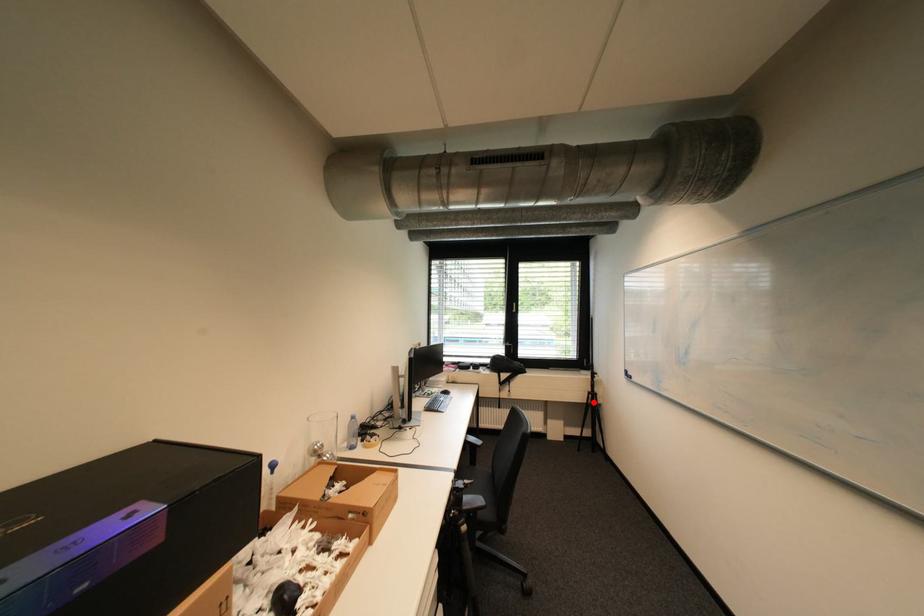
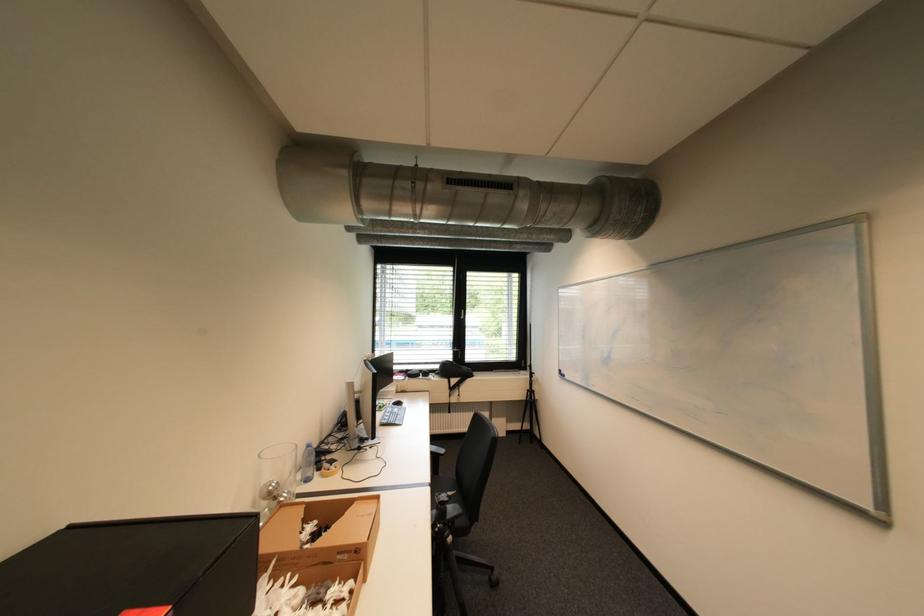
The point at the highlighted location is marked in the first image. Where is the corresponding point in the second image?

(532, 400)